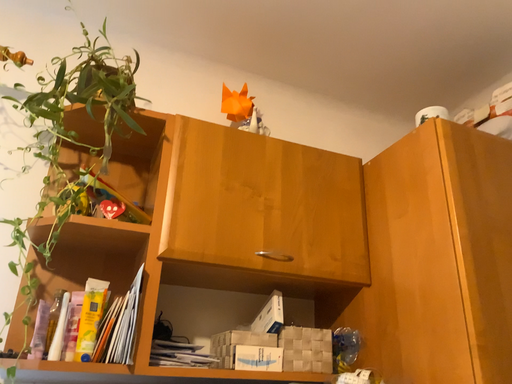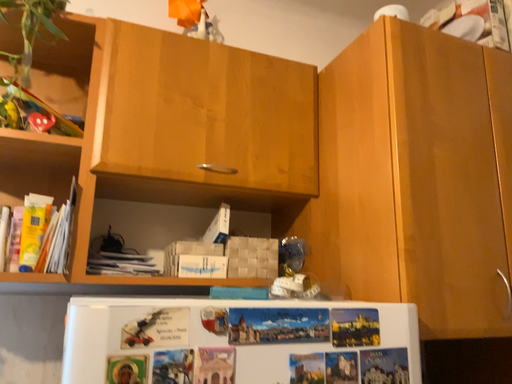
Question: Which way did the camera rotate in the video?

Choices:
 (A) rotated upward
 (B) rotated downward

Answer: (B)